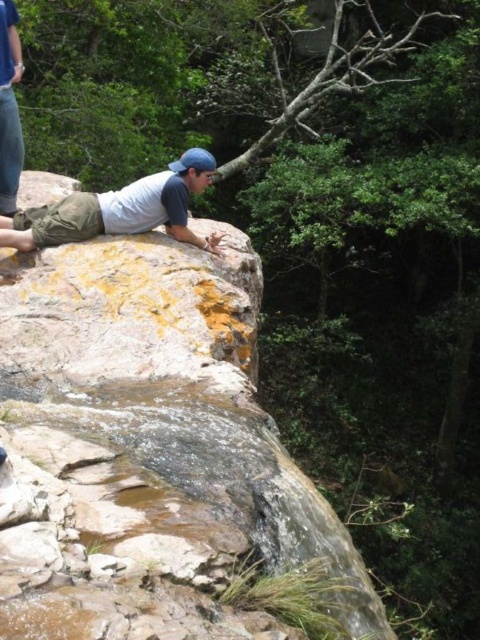
Where is `matte gray shirt at center`? Image resolution: width=480 pixels, height=640 pixels. matte gray shirt at center is located at coordinates (119, 209).